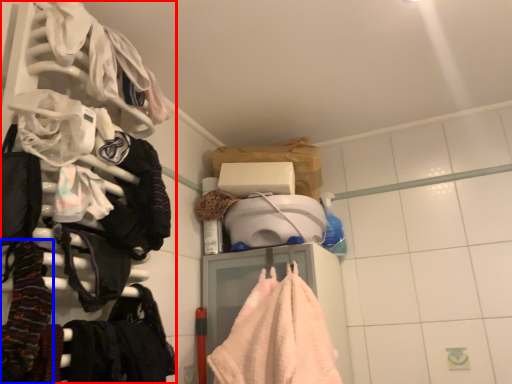
Question: Which object is further to the camera taking this photo, closet (highlighted by a red box) or clothing (highlighted by a blue box)?

Choices:
 (A) closet
 (B) clothing

Answer: (B)